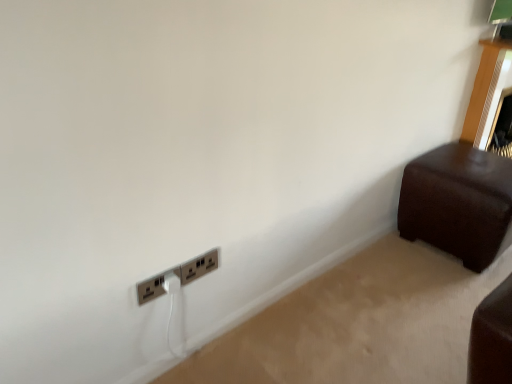
What do you see at coordinates (199, 266) in the screenshot? I see `satin silver power plugs and sockets at lower left, placed as the 2th power plugs and sockets when sorted from left to right` at bounding box center [199, 266].

Where is `satin silver power plugs and sockets at lower left, which is the 1th power plugs and sockets from right to left`? satin silver power plugs and sockets at lower left, which is the 1th power plugs and sockets from right to left is located at coordinates (199, 266).

What are the coordinates of `metallic silver power plugs and sockets at lower left, the 1th power plugs and sockets in the left-to-right sequence` in the screenshot? It's located at (150, 289).

This screenshot has height=384, width=512. What are the coordinates of `brown leather ottoman at right` in the screenshot? It's located at (457, 202).

Consider the image. Measure the distance between brown leather ottoman at right and metallic silver power plugs and sockets at lower left, which ranks as the 2th power plugs and sockets in right-to-left order.

4.69 feet.

Is metallic silver power plugs and sockets at lower left, which ranks as the 2th power plugs and sockets in right-to-left order, surrounded by brown leather ottoman at right?

That's incorrect, metallic silver power plugs and sockets at lower left, which ranks as the 2th power plugs and sockets in right-to-left order, is not inside brown leather ottoman at right.

From a real-world perspective, which power plugs and sockets is the 1st one above the brown leather ottoman at right? Please provide its 2D coordinates.

[(150, 289)]

Is brown leather ottoman at right facing away from metallic silver power plugs and sockets at lower left, the 1th power plugs and sockets in the left-to-right sequence?

No.

Considering the sizes of objects satin silver power plugs and sockets at lower left, which is the 1th power plugs and sockets from right to left, and brown leather ottoman at right in the image provided, who is wider, satin silver power plugs and sockets at lower left, which is the 1th power plugs and sockets from right to left, or brown leather ottoman at right?

Wider between the two is brown leather ottoman at right.

Is satin silver power plugs and sockets at lower left, which is the 1th power plugs and sockets from right to left, oriented towards brown leather ottoman at right?

No.

Could brown leather ottoman at right be considered to be inside satin silver power plugs and sockets at lower left, which is the 1th power plugs and sockets from right to left?

Actually, brown leather ottoman at right is outside satin silver power plugs and sockets at lower left, which is the 1th power plugs and sockets from right to left.

From the image's perspective, is satin silver power plugs and sockets at lower left, which is the 1th power plugs and sockets from right to left, above brown leather ottoman at right?

No.

Can you confirm if metallic silver power plugs and sockets at lower left, the 1th power plugs and sockets in the left-to-right sequence, is positioned to the right of satin silver power plugs and sockets at lower left, placed as the 2th power plugs and sockets when sorted from left to right?

No.

Considering the points (145, 299) and (180, 278), which point is in front, point (145, 299) or point (180, 278)?

Positioned in front is point (145, 299).

Considering the relative sizes of metallic silver power plugs and sockets at lower left, the 1th power plugs and sockets in the left-to-right sequence, and satin silver power plugs and sockets at lower left, which is the 1th power plugs and sockets from right to left, in the image provided, is metallic silver power plugs and sockets at lower left, the 1th power plugs and sockets in the left-to-right sequence, wider than satin silver power plugs and sockets at lower left, which is the 1th power plugs and sockets from right to left,?

Yes.

Is metallic silver power plugs and sockets at lower left, which ranks as the 2th power plugs and sockets in right-to-left order, next to satin silver power plugs and sockets at lower left, which is the 1th power plugs and sockets from right to left, and touching it?

No, metallic silver power plugs and sockets at lower left, which ranks as the 2th power plugs and sockets in right-to-left order, is not beside satin silver power plugs and sockets at lower left, which is the 1th power plugs and sockets from right to left.

Which is closer to the camera, (204, 266) or (154, 290)?

Clearly, point (204, 266) is more distant from the camera than point (154, 290).

Is satin silver power plugs and sockets at lower left, which is the 1th power plugs and sockets from right to left, located outside metallic silver power plugs and sockets at lower left, the 1th power plugs and sockets in the left-to-right sequence?

Yes, satin silver power plugs and sockets at lower left, which is the 1th power plugs and sockets from right to left, is not within metallic silver power plugs and sockets at lower left, the 1th power plugs and sockets in the left-to-right sequence.

Is there a large distance between satin silver power plugs and sockets at lower left, which is the 1th power plugs and sockets from right to left, and metallic silver power plugs and sockets at lower left, the 1th power plugs and sockets in the left-to-right sequence?

No, satin silver power plugs and sockets at lower left, which is the 1th power plugs and sockets from right to left, is in close proximity to metallic silver power plugs and sockets at lower left, the 1th power plugs and sockets in the left-to-right sequence.

Which is more to the right, brown leather ottoman at right or satin silver power plugs and sockets at lower left, which is the 1th power plugs and sockets from right to left?

Positioned to the right is brown leather ottoman at right.

Does point (468, 243) come closer to viewer compared to point (213, 250)?

No, (468, 243) is further to viewer.

From a real-world perspective, between brown leather ottoman at right and satin silver power plugs and sockets at lower left, placed as the 2th power plugs and sockets when sorted from left to right, who is vertically higher?

satin silver power plugs and sockets at lower left, placed as the 2th power plugs and sockets when sorted from left to right, from a real-world perspective.

From the image's perspective, which is above, brown leather ottoman at right or satin silver power plugs and sockets at lower left, which is the 1th power plugs and sockets from right to left?

brown leather ottoman at right appears higher in the image.

Considering the sizes of objects metallic silver power plugs and sockets at lower left, the 1th power plugs and sockets in the left-to-right sequence, and brown leather ottoman at right in the image provided, who is bigger, metallic silver power plugs and sockets at lower left, the 1th power plugs and sockets in the left-to-right sequence, or brown leather ottoman at right?

brown leather ottoman at right.

How many degrees apart are the facing directions of metallic silver power plugs and sockets at lower left, which ranks as the 2th power plugs and sockets in right-to-left order, and brown leather ottoman at right?

The angular difference between metallic silver power plugs and sockets at lower left, which ranks as the 2th power plugs and sockets in right-to-left order, and brown leather ottoman at right is 3.53 degrees.

This screenshot has height=384, width=512. Find the location of `furniture located on the right of metallic silver power plugs and sockets at lower left, the 1th power plugs and sockets in the left-to-right sequence`. furniture located on the right of metallic silver power plugs and sockets at lower left, the 1th power plugs and sockets in the left-to-right sequence is located at coordinates (457, 202).

From the image's perspective, relative to brown leather ottoman at right, is metallic silver power plugs and sockets at lower left, which ranks as the 2th power plugs and sockets in right-to-left order, above or below?

Based on their image positions, metallic silver power plugs and sockets at lower left, which ranks as the 2th power plugs and sockets in right-to-left order, is located beneath brown leather ottoman at right.

You are a GUI agent. You are given a task and a screenshot of the screen. Output one action in this format:
    pyautogui.click(x=<x>, y=<y>)
    Task: Click on the furniture lying behind the metallic silver power plugs and sockets at lower left, the 1th power plugs and sockets in the left-to-right sequence
    The image size is (512, 384).
    Given the screenshot: What is the action you would take?
    pyautogui.click(x=457, y=202)

Where is `the 1st power plugs and sockets in front of the brown leather ottoman at right`? the 1st power plugs and sockets in front of the brown leather ottoman at right is located at coordinates (199, 266).

Looking at the image, which one is located closer to metallic silver power plugs and sockets at lower left, which ranks as the 2th power plugs and sockets in right-to-left order, satin silver power plugs and sockets at lower left, which is the 1th power plugs and sockets from right to left, or brown leather ottoman at right?

satin silver power plugs and sockets at lower left, which is the 1th power plugs and sockets from right to left, lies closer to metallic silver power plugs and sockets at lower left, which ranks as the 2th power plugs and sockets in right-to-left order, than the other object.

Looking at the image, which one is located further to satin silver power plugs and sockets at lower left, which is the 1th power plugs and sockets from right to left, brown leather ottoman at right or metallic silver power plugs and sockets at lower left, the 1th power plugs and sockets in the left-to-right sequence?

brown leather ottoman at right is further to satin silver power plugs and sockets at lower left, which is the 1th power plugs and sockets from right to left.

Looking at the image, which one is located further to brown leather ottoman at right, metallic silver power plugs and sockets at lower left, which ranks as the 2th power plugs and sockets in right-to-left order, or satin silver power plugs and sockets at lower left, placed as the 2th power plugs and sockets when sorted from left to right?

metallic silver power plugs and sockets at lower left, which ranks as the 2th power plugs and sockets in right-to-left order.

Estimate the real-world distances between objects in this image. Which object is further from metallic silver power plugs and sockets at lower left, which ranks as the 2th power plugs and sockets in right-to-left order, brown leather ottoman at right or satin silver power plugs and sockets at lower left, which is the 1th power plugs and sockets from right to left?

brown leather ottoman at right.

Estimate the real-world distances between objects in this image. Which object is closer to brown leather ottoman at right, satin silver power plugs and sockets at lower left, which is the 1th power plugs and sockets from right to left, or metallic silver power plugs and sockets at lower left, which ranks as the 2th power plugs and sockets in right-to-left order?

satin silver power plugs and sockets at lower left, which is the 1th power plugs and sockets from right to left.

Looking at the image, which one is located further to satin silver power plugs and sockets at lower left, which is the 1th power plugs and sockets from right to left, metallic silver power plugs and sockets at lower left, which ranks as the 2th power plugs and sockets in right-to-left order, or brown leather ottoman at right?

Among the two, brown leather ottoman at right is located further to satin silver power plugs and sockets at lower left, which is the 1th power plugs and sockets from right to left.

The image size is (512, 384). I want to click on power plugs and sockets between metallic silver power plugs and sockets at lower left, which ranks as the 2th power plugs and sockets in right-to-left order, and brown leather ottoman at right, in the horizontal direction, so click(x=199, y=266).